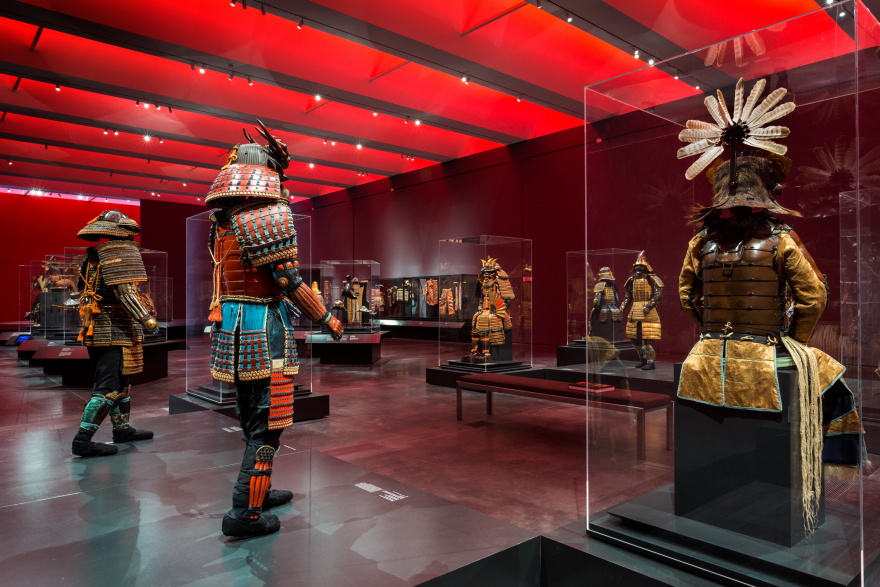
Locate an element on the screen. display is located at coordinates (785, 284), (663, 311), (599, 294), (489, 323), (497, 276), (436, 301), (356, 301), (66, 286), (39, 281).